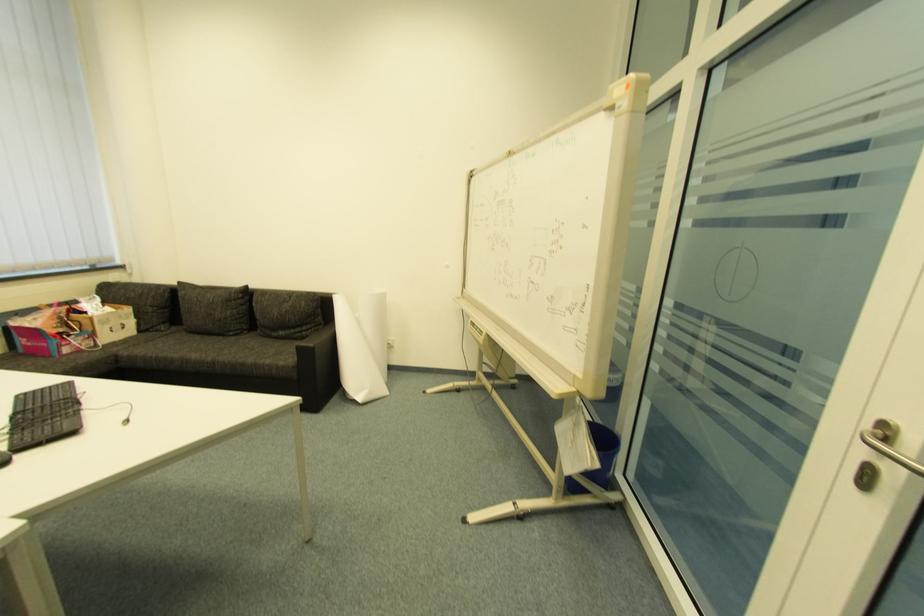
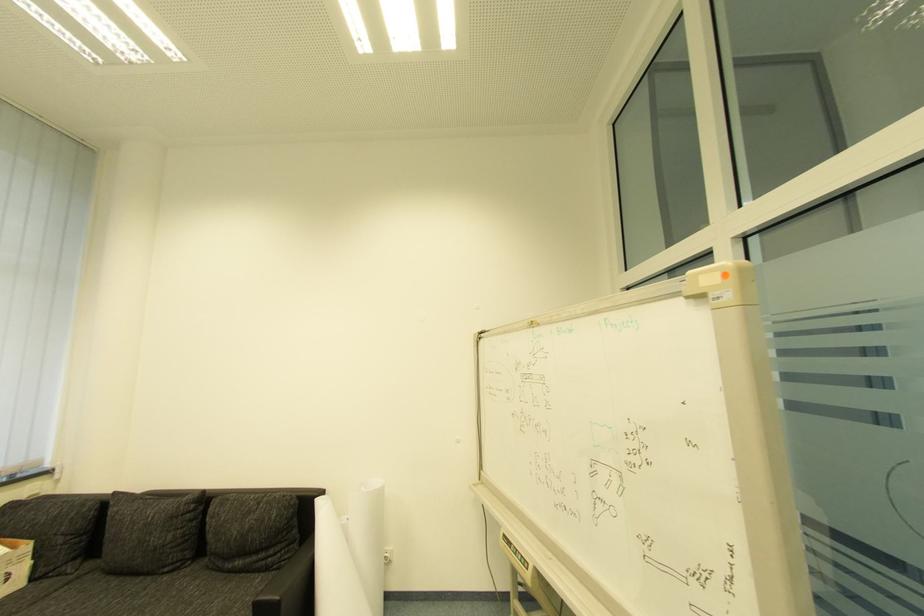
Question: Based on the continuous images, in which direction is the camera rotating? Reply with the corresponding letter.

Choices:
 (A) Left
 (B) Right
 (C) Up
 (D) Down

Answer: (C)